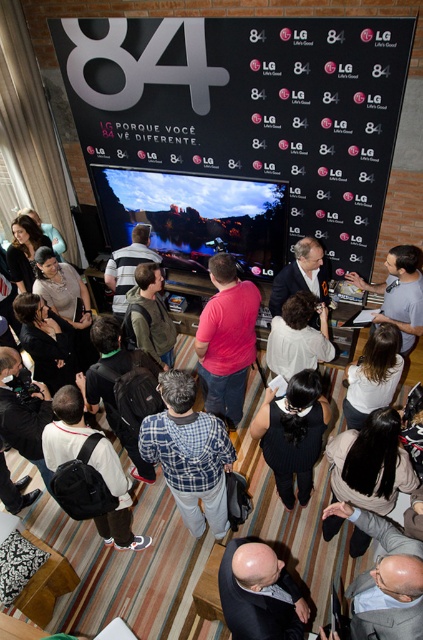
Who is positioned more to the left, pink fabric shirt at center or gray casual shirt at center?

From the viewer's perspective, pink fabric shirt at center appears more on the left side.

Which is below, pink fabric shirt at center or gray casual shirt at center?

Positioned lower is pink fabric shirt at center.

Where is `pink fabric shirt at center`? pink fabric shirt at center is located at coordinates (227, 339).

Is point (241, 586) farther from viewer compared to point (299, 291)?

No, (241, 586) is in front of (299, 291).

At what (x,y) coordinates should I click in order to perform the action: click on dark suit at center. Please return your answer as a coordinate pair (x, y). This screenshot has width=423, height=640. Looking at the image, I should click on (258, 593).

Which is behind, point (205, 113) or point (208, 506)?

The point (205, 113) is more distant.

Who is more forward, (x=296, y=232) or (x=211, y=445)?

Positioned in front is point (x=211, y=445).

Between point (362, 81) and point (170, 401), which one is positioned behind?

The point (362, 81) is more distant.

Identify the location of metallic silver screen at center. The width and height of the screenshot is (423, 640). (247, 112).